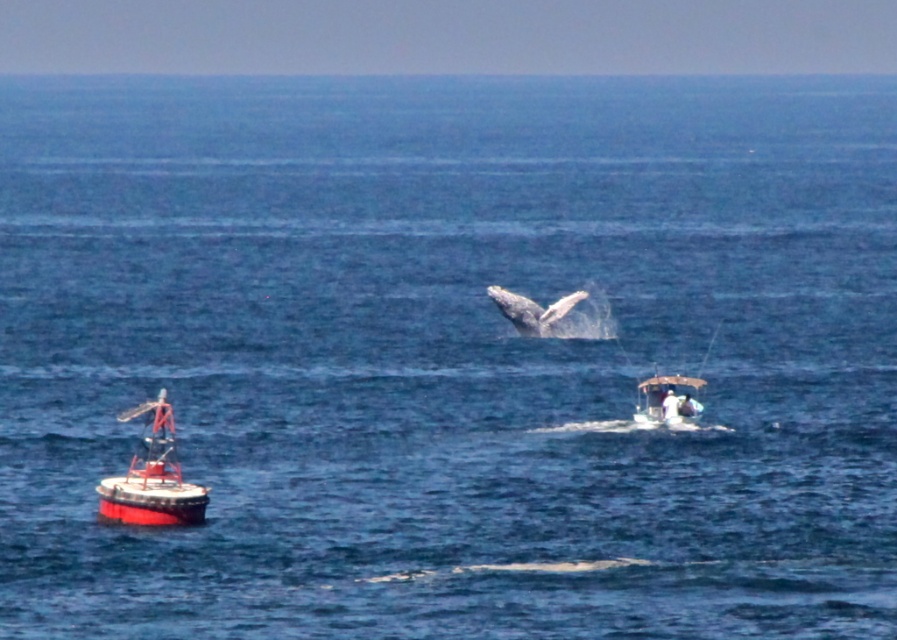
Question: Which point is closer to the camera?

Choices:
 (A) wooden boat at center
 (B) red painted buoy at left
 (C) gray matte whale at center

Answer: (B)

Question: Does wooden boat at center have a smaller size compared to gray matte whale at center?

Choices:
 (A) no
 (B) yes

Answer: (B)

Question: Considering the relative positions of red painted buoy at left and wooden boat at center in the image provided, where is red painted buoy at left located with respect to wooden boat at center?

Choices:
 (A) above
 (B) below

Answer: (B)

Question: Which of the following is the farthest from the observer?

Choices:
 (A) tap(509, 314)
 (B) tap(173, 436)

Answer: (A)

Question: Which point is farther from the camera taking this photo?

Choices:
 (A) (640, 401)
 (B) (147, 515)

Answer: (A)

Question: Is wooden boat at center below gray matte whale at center?

Choices:
 (A) yes
 (B) no

Answer: (A)